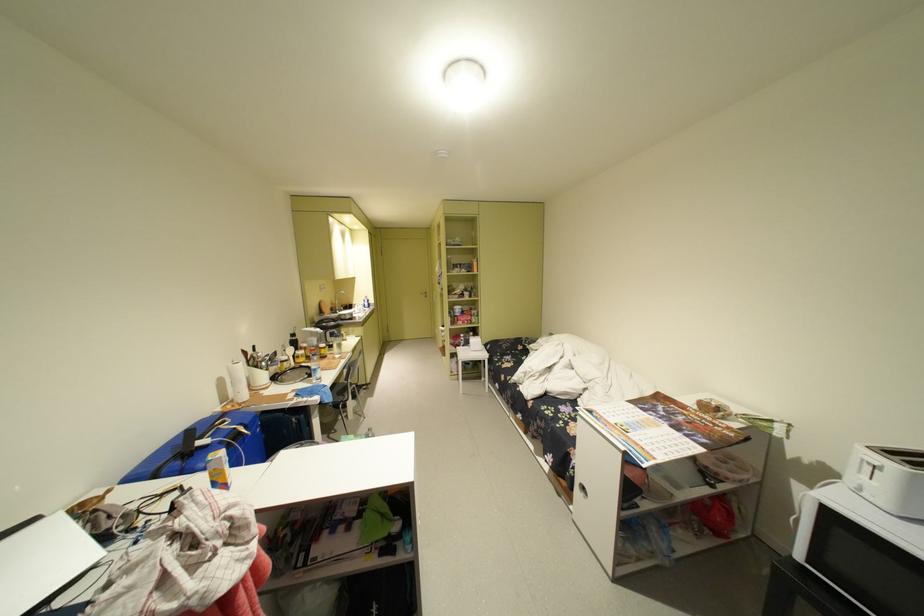
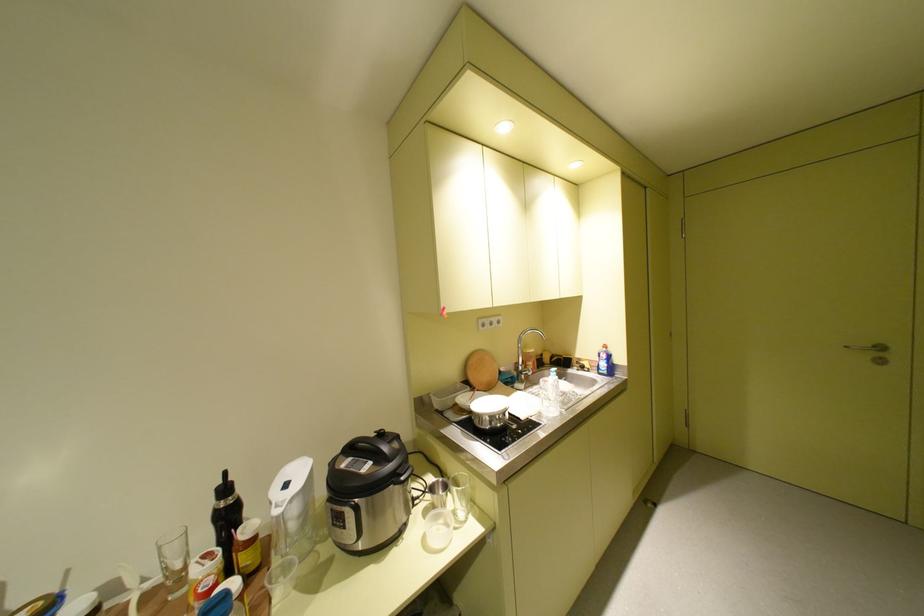
The point at (374,309) is marked in the first image. Where is the corresponding point in the second image?

(603, 376)